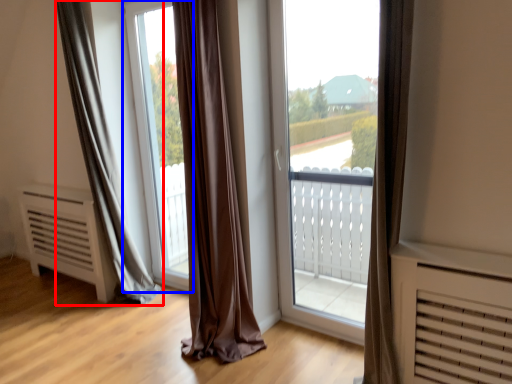
Question: Which object is further to the camera taking this photo, curtain (highlighted by a red box) or window screen (highlighted by a blue box)?

Choices:
 (A) curtain
 (B) window screen

Answer: (B)